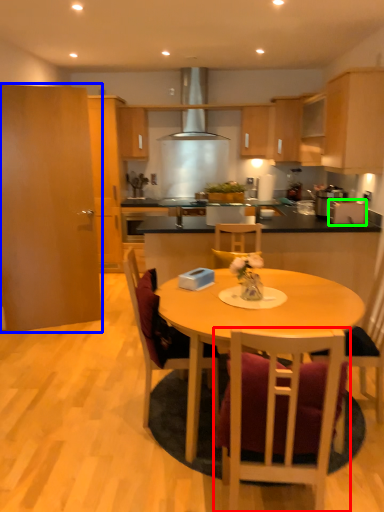
Question: Based on their relative distances, which object is farther from chair (highlighted by a red box)? Choose from cabinetry (highlighted by a blue box) and appliance (highlighted by a green box).

Choices:
 (A) cabinetry
 (B) appliance

Answer: (A)